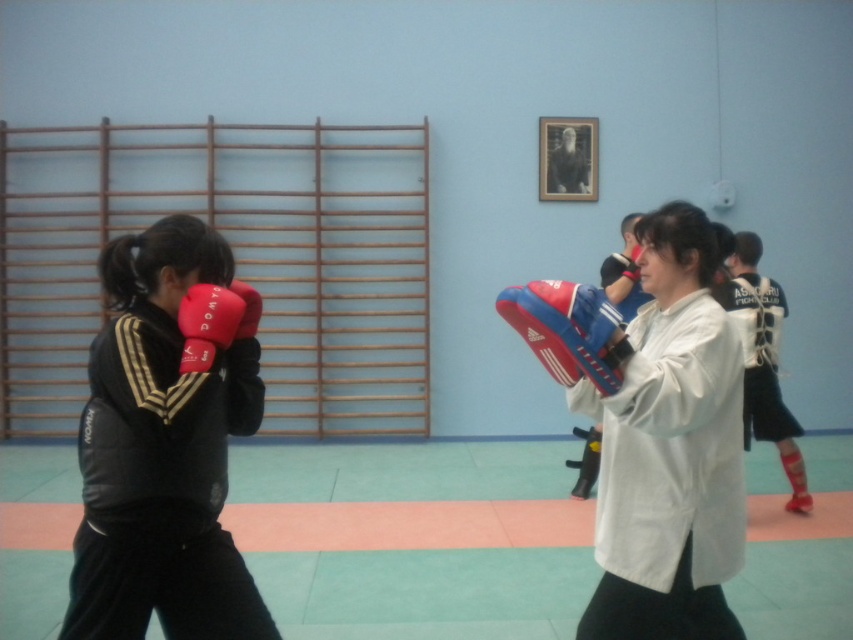
You are standing in the martial arts gym and see the point marked at coordinates (183, 451). If you want to reach this point without moving your feet, can you do it with your arm?

The point at (183, 451) is 6.47 feet away from the viewer. Since the average human arm length is about 2.5 feet, you cannot reach it without moving your feet.

You are observing a martial arts training session and notice two items at the left side of the scene. Which item is positioned lower down between the matte black jacket at left and the matte red boxing glove at left?

The matte black jacket at left is positioned below the matte red boxing glove at left, so it is the lower item.